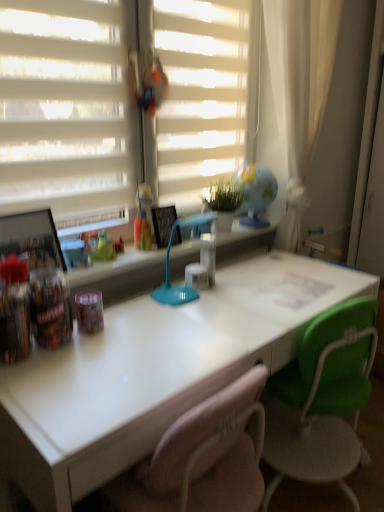
What are the coordinates of `free space to the left of blue plastic table lamp at center` in the screenshot? It's located at (136, 313).